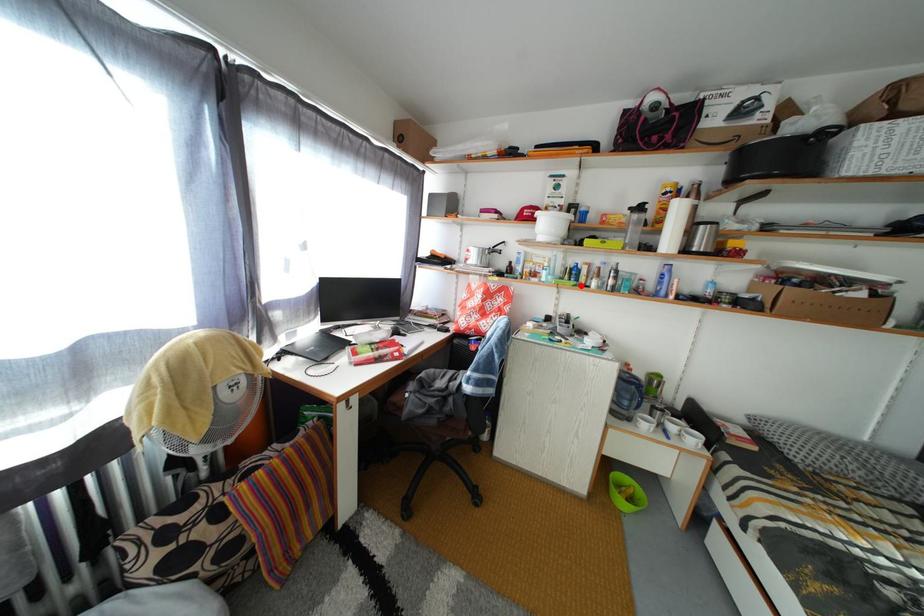
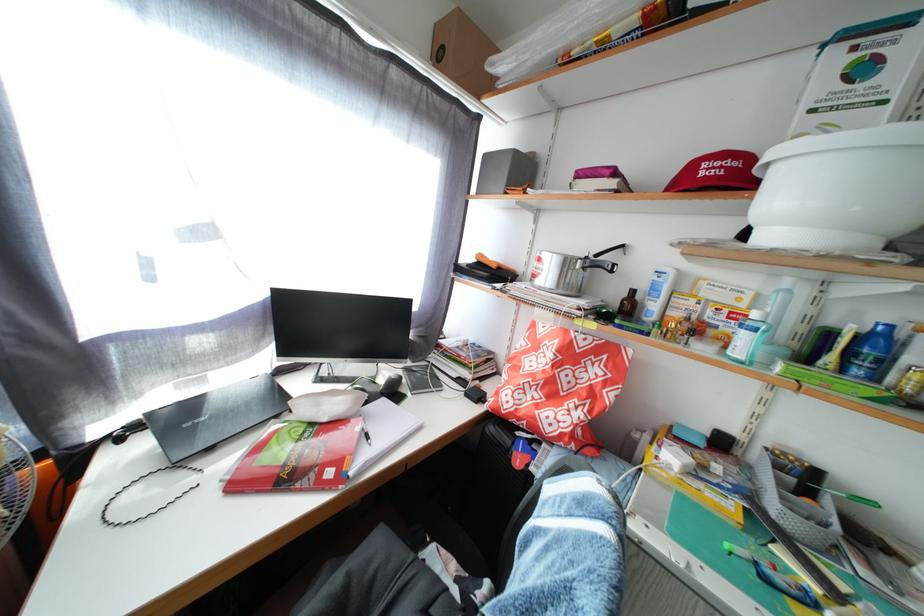
Find the pixel in the second image that matches the highlighted location in the first image.

(866, 378)